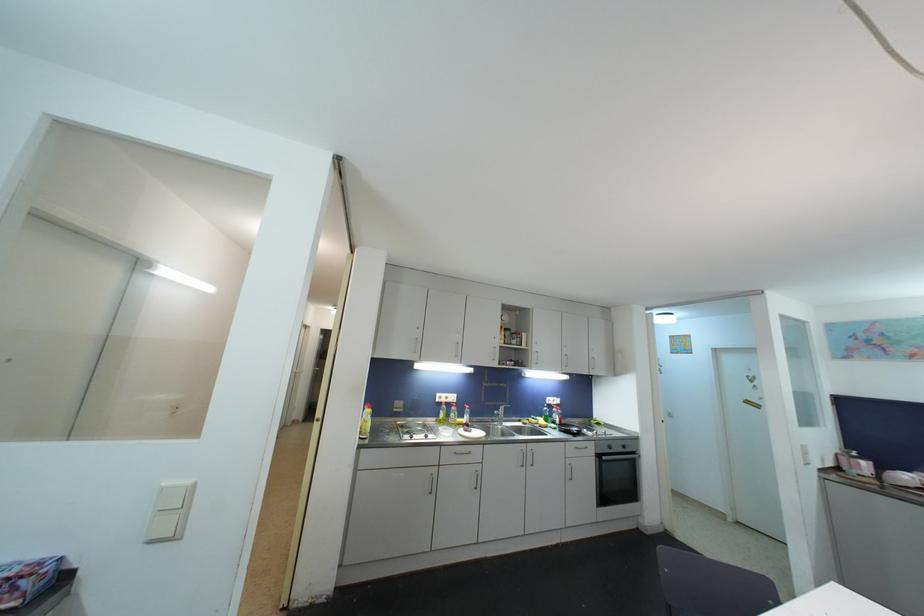
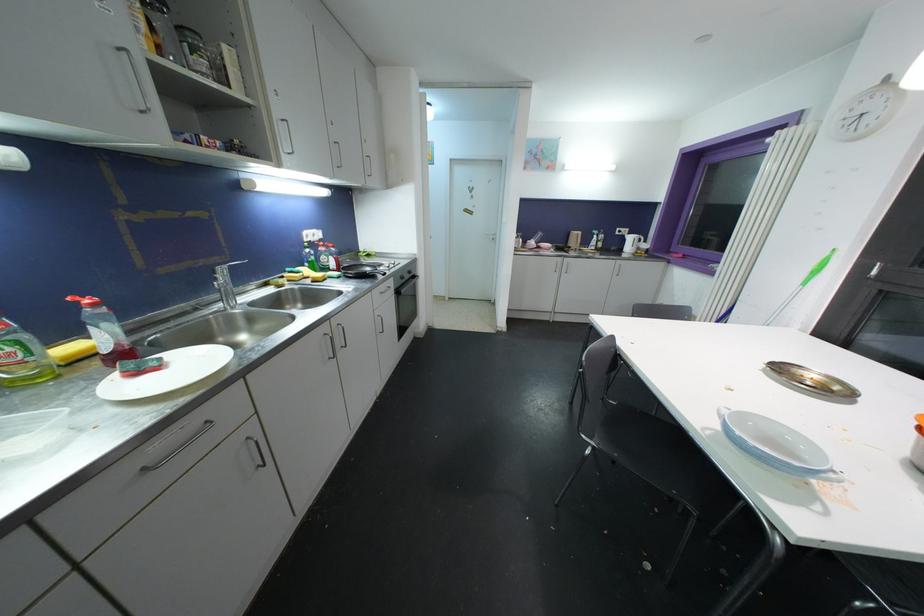
Find the pixel in the second image that matches point 570,464 in the first image.

(379, 318)